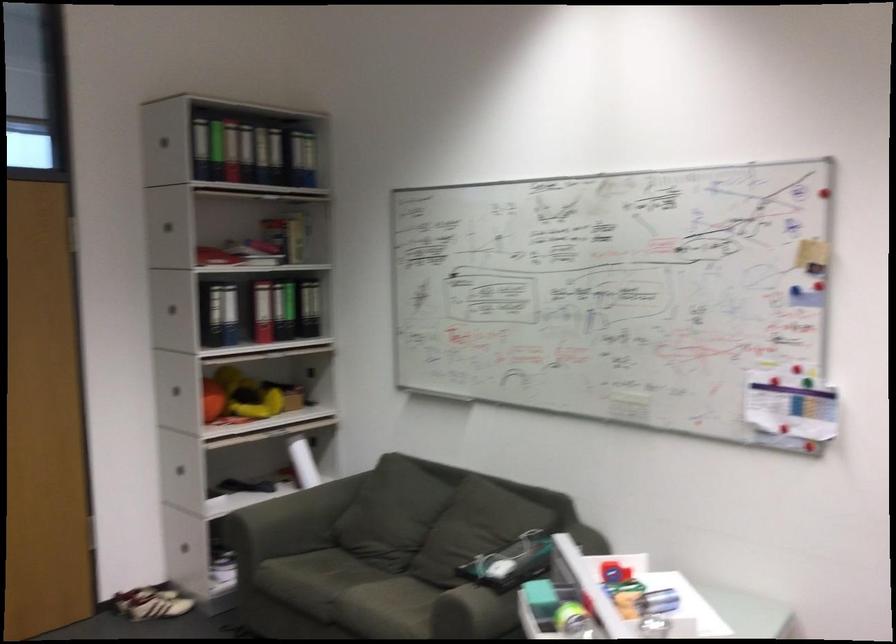
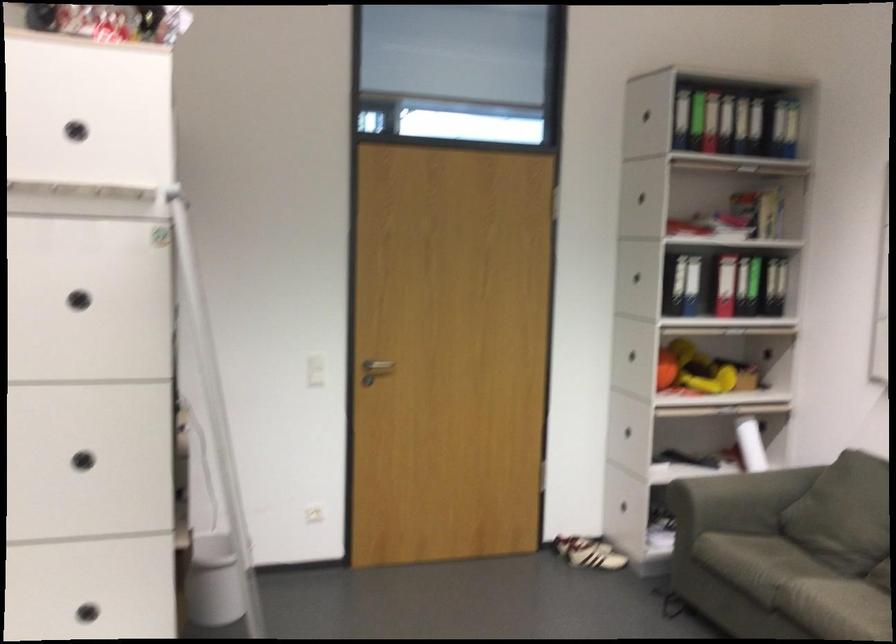
Question: I am providing you with two images of the same scene from different viewpoints. Which of the following objects are not visible in image2?

Choices:
 (A) black binder
 (B) rolled white paper
 (C) black circular handle
 (D) none of these

Answer: (D)